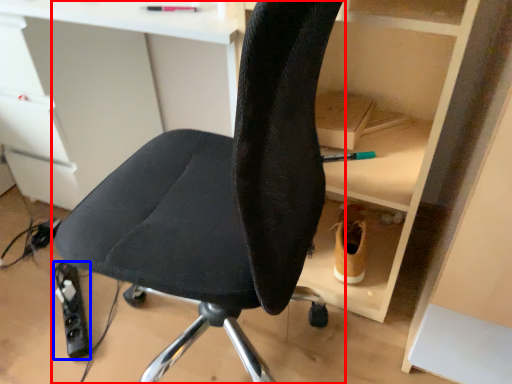
Question: Which of the following is the farthest to the observer, chair (highlighted by a red box) or equipment (highlighted by a blue box)?

Choices:
 (A) chair
 (B) equipment

Answer: (B)